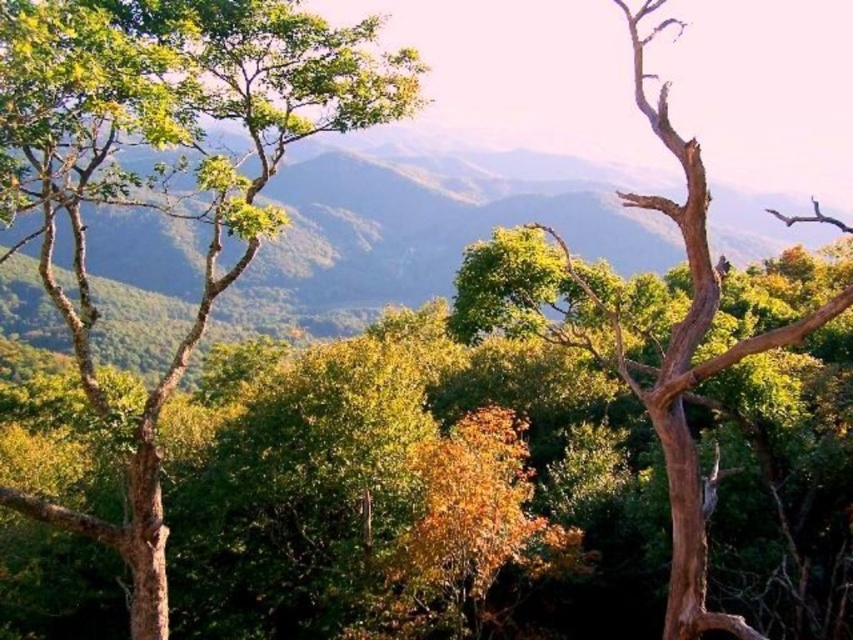
Describe the element at coordinates (169, 170) in the screenshot. I see `green matte tree at left` at that location.

Which is more to the right, green matte tree at left or green leafy trees at left?

From the viewer's perspective, green leafy trees at left appears more on the right side.

Is point (32, 22) less distant than point (392, 182)?

Yes, it is.

At what (x,y) coordinates should I click in order to perform the action: click on green matte tree at left. Please return your answer as a coordinate pair (x, y). Looking at the image, I should click on (169, 170).

Which of these two, green matte tree at left or brown textured tree trunk at right, stands shorter?

Standing shorter between the two is green matte tree at left.

Between point (68, 516) and point (662, 636), which one is positioned behind?

The point (662, 636) is behind.

The height and width of the screenshot is (640, 853). What are the coordinates of `green matte tree at left` in the screenshot? It's located at (169, 170).

The width and height of the screenshot is (853, 640). In order to click on green leafy trees at left in this screenshot , I will do `click(415, 236)`.

From the picture: Is green leafy trees at left positioned in front of brown textured tree trunk at right?

No, green leafy trees at left is further to the viewer.

Is point (120, 250) positioned before point (784, 330)?

No, it is behind (784, 330).

Locate an element on the screen. The image size is (853, 640). green leafy trees at left is located at coordinates (415, 236).